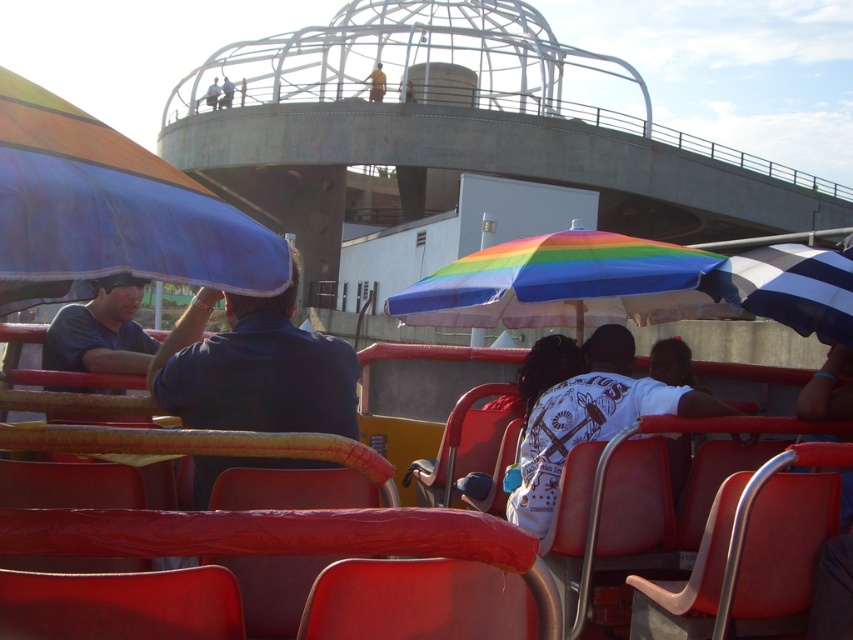
Is rainbow fabric umbrella at left smaller than blue fabric umbrella at left?

Incorrect, rainbow fabric umbrella at left is not smaller in size than blue fabric umbrella at left.

Who is positioned more to the right, rainbow fabric umbrella at left or blue fabric umbrella at left?

From the viewer's perspective, blue fabric umbrella at left appears more on the right side.

Which is in front, point (6, 177) or point (262, 323)?

Point (6, 177)

You are a GUI agent. You are given a task and a screenshot of the screen. Output one action in this format:
    pyautogui.click(x=<x>, y=<y>)
    Task: Click on the rainbow fabric umbrella at left
    The image size is (853, 640).
    Given the screenshot: What is the action you would take?
    pyautogui.click(x=109, y=211)

Measure the distance from matte blue shirt at left to yellow fabric umbrella at upper center.

They are 41.31 meters apart.

Does matte blue shirt at left have a lesser width compared to yellow fabric umbrella at upper center?

Yes.

Is point (91, 305) more distant than point (370, 80)?

That is False.

Locate an element on the screen. The width and height of the screenshot is (853, 640). matte blue shirt at left is located at coordinates (102, 332).

Is white matte shirt at center smaller than striped fabric umbrella at right?

Incorrect, white matte shirt at center is not smaller in size than striped fabric umbrella at right.

Which is in front, point (541, 529) or point (822, 337)?

Point (822, 337) is in front.

Between point (538, 452) and point (776, 252), which one is positioned behind?

The point (538, 452) is more distant.

You are a GUI agent. You are given a task and a screenshot of the screen. Output one action in this format:
    pyautogui.click(x=<x>, y=<y>)
    Task: Click on the white matte shirt at center
    This screenshot has height=640, width=853.
    Given the screenshot: What is the action you would take?
    pyautogui.click(x=590, y=419)